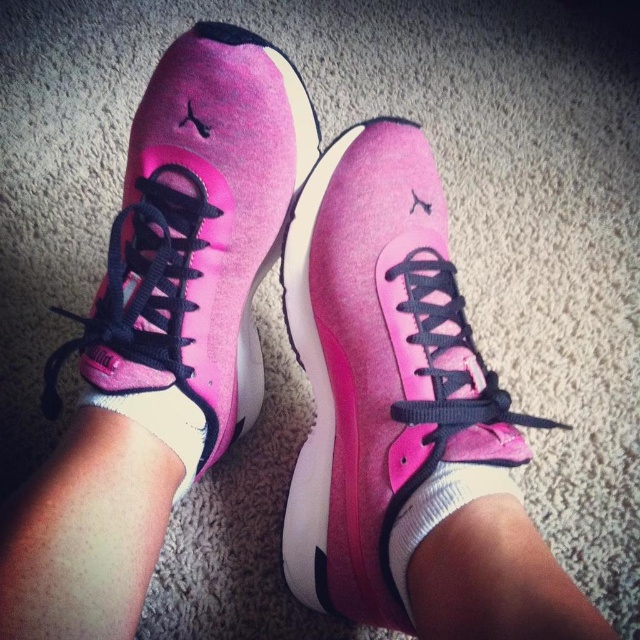
Is suede pink sneaker at center shorter than white soft sock at lower center?

No, suede pink sneaker at center is not shorter than white soft sock at lower center.

Can you confirm if suede pink sneaker at center is positioned to the right of white soft sock at lower center?

No, suede pink sneaker at center is not to the right of white soft sock at lower center.

Where is `suede pink sneaker at center`? suede pink sneaker at center is located at coordinates pos(195,243).

Is pink suede sneaker at center above white soft sock at lower center?

Yes, pink suede sneaker at center is above white soft sock at lower center.

Which is below, pink suede sneaker at center or white soft sock at lower center?

Positioned lower is white soft sock at lower center.

Which is in front, point (364, 124) or point (394, 536)?

Positioned in front is point (394, 536).

Locate an element on the screen. The width and height of the screenshot is (640, 640). pink suede sneaker at center is located at coordinates (378, 365).

Which of these two, pink suede sneaker at center or white cotton sock at center, stands taller?

With more height is pink suede sneaker at center.

Does point (426, 202) come behind point (179, 445)?

Yes, it is behind point (179, 445).

Looking at this image, who is more forward, (419, 403) or (184, 472)?

Point (419, 403) is more forward.

Identify the location of pink suede sneaker at center. The height and width of the screenshot is (640, 640). (378, 365).